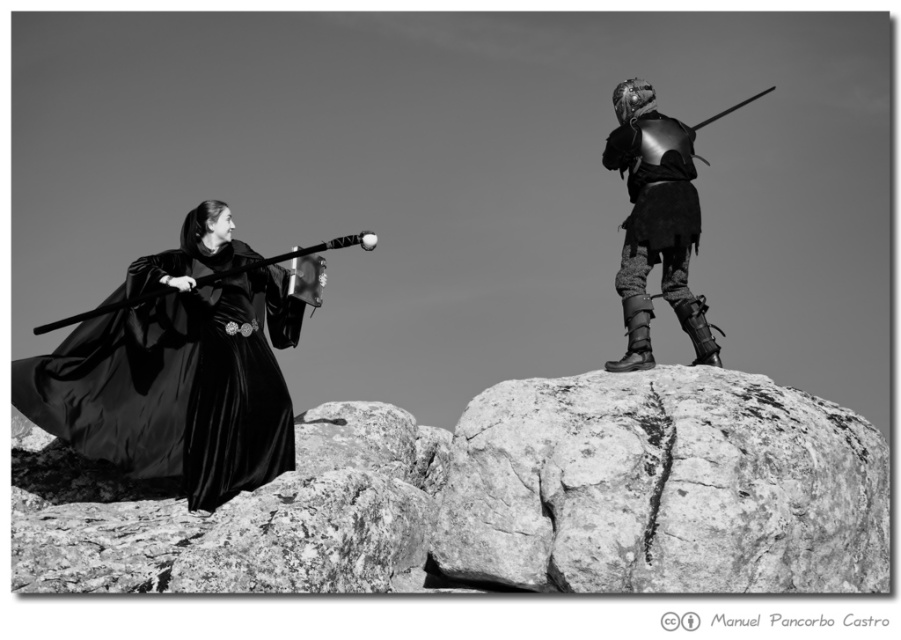
Consider the image. Based on the scene description, which object is positioned lower in the image, the rough textured rock at center or the velvet black robe at left?

The rough textured rock at center is positioned lower than the velvet black robe at left in the image.

You are an observer in the scene described. You notice the rough textured rock at center and the velvet black robe at left. Which object is positioned farther to the east?

The velvet black robe at left is positioned farther to the east because it is located to the left of the rough textured rock at center, and in the scene, left typically corresponds to east.